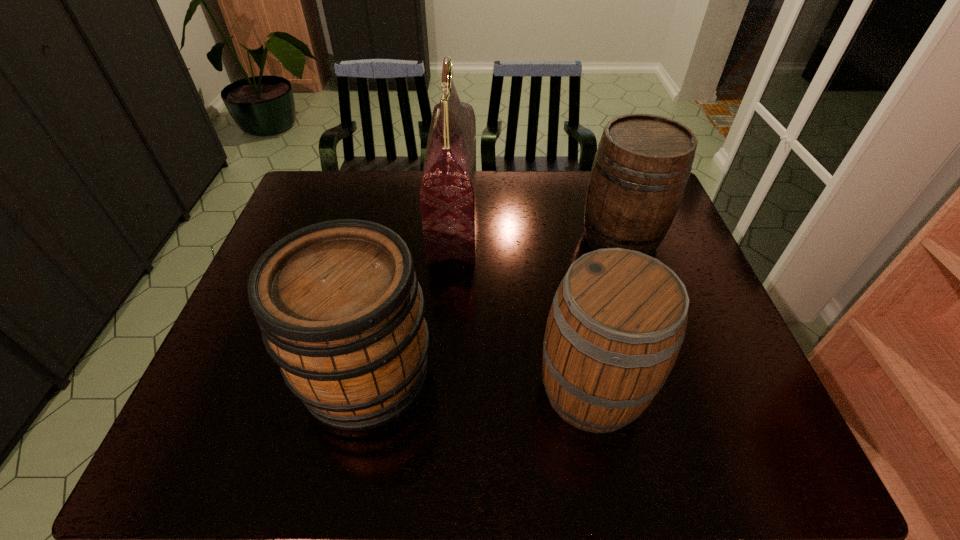
The image size is (960, 540). Find the location of `object present at the right edge`. object present at the right edge is located at coordinates (643, 162).

At what (x,y) coordinates should I click in order to perform the action: click on object situated at the far right corner. Please return your answer as a coordinate pair (x, y). The image size is (960, 540). Looking at the image, I should click on (643, 162).

Locate an element on the screen. The width and height of the screenshot is (960, 540). vacant space at the far edge is located at coordinates (481, 174).

In order to click on blank space at the near edge of the desktop in this screenshot , I will do `click(643, 462)`.

In the image, there is a desktop. Where is `vacant area at the left edge`? vacant area at the left edge is located at coordinates (251, 367).

In the image, there is a desktop. Identify the location of free region at the far left corner. This screenshot has width=960, height=540. (327, 186).

Where is `the closest object to the tallest object`? Image resolution: width=960 pixels, height=540 pixels. the closest object to the tallest object is located at coordinates (340, 309).

Choose which object is the nearest neighbor to the farthest cider. Please provide its 2D coordinates. Your answer should be formatted as a tuple, i.e. [(x, y)], where the tuple contains the x and y coordinates of a point satisfying the conditions above.

[(617, 322)]

Where is `cider that is the second closest to the handbag`? This screenshot has width=960, height=540. cider that is the second closest to the handbag is located at coordinates (617, 322).

Select which cider appears as the closest to the farthest cider. Please provide its 2D coordinates. Your answer should be formatted as a tuple, i.e. [(x, y)], where the tuple contains the x and y coordinates of a point satisfying the conditions above.

[(617, 322)]